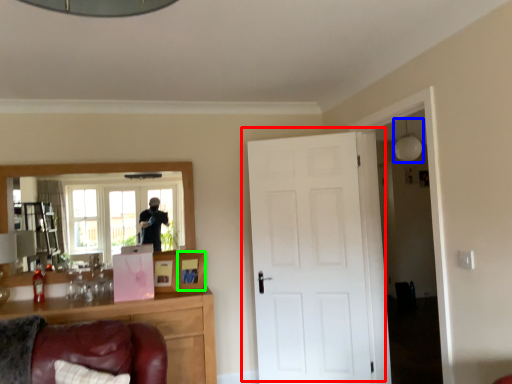
Question: Which object is positioned closest to door (highlighted by a red box)? Select from light fixture (highlighted by a blue box) and picture frame (highlighted by a green box).

Choices:
 (A) light fixture
 (B) picture frame

Answer: (B)